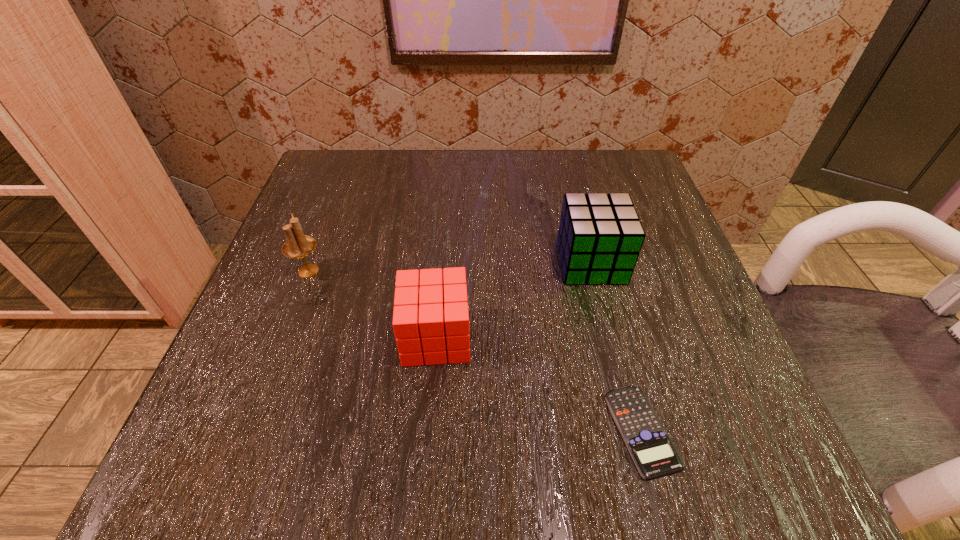
The width and height of the screenshot is (960, 540). Find the location of `blank region between the second nearest object and the farther cube`. blank region between the second nearest object and the farther cube is located at coordinates (514, 300).

Where is `free space between the shortest object and the right cube`? The height and width of the screenshot is (540, 960). free space between the shortest object and the right cube is located at coordinates (616, 346).

I want to click on blank region between the candle holder and the right cube, so click(x=450, y=267).

Where is `object that is the third closest to the third object from right to left`? This screenshot has width=960, height=540. object that is the third closest to the third object from right to left is located at coordinates (652, 450).

You are a GUI agent. You are given a task and a screenshot of the screen. Output one action in this format:
    pyautogui.click(x=<x>, y=<y>)
    Task: Click on the object that ranks as the third closest to the right cube
    This screenshot has width=960, height=540.
    Given the screenshot: What is the action you would take?
    pyautogui.click(x=298, y=245)

Identify the location of vacant space that satisfies the following two spatial constraints: 1. on the front side of the calculator; 2. on the right side of the left cube. Image resolution: width=960 pixels, height=540 pixels. coord(428,430).